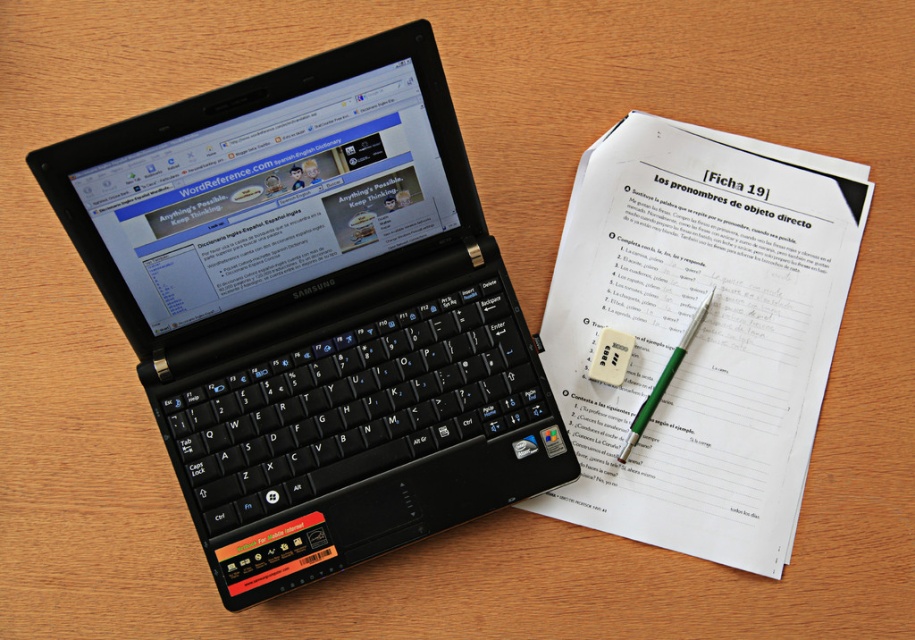
Can you confirm if white paper at upper right is positioned to the left of black plastic keyboard at center?

No, white paper at upper right is not to the left of black plastic keyboard at center.

Between white paper at upper right and black plastic keyboard at center, which one has less height?

With less height is black plastic keyboard at center.

Which is behind, point (743, 564) or point (417, 412)?

The point (417, 412) is behind.

At what (x,y) coordinates should I click in order to perform the action: click on white paper at upper right. Please return your answer as a coordinate pair (x, y). Looking at the image, I should click on (698, 332).

Who is higher up, black plastic keyboard at center or green plastic pen at upper right?

green plastic pen at upper right is above.

Does black plastic keyboard at center come in front of green plastic pen at upper right?

Yes.

Which is behind, point (472, 428) or point (631, 440)?

The point (631, 440) is more distant.

Identify the location of black plastic keyboard at center. The image size is (915, 640). (353, 404).

Does point (436, 128) come behind point (616, 419)?

No, it is not.

Measure the distance between point (291,342) and camera.

A distance of 31.40 inches exists between point (291,342) and camera.

Describe the element at coordinates (314, 310) in the screenshot. The height and width of the screenshot is (640, 915). I see `black plastic laptop at upper left` at that location.

Locate an element on the screen. black plastic laptop at upper left is located at coordinates (314, 310).